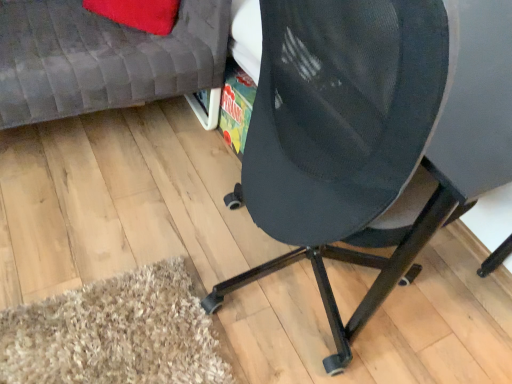
Question: From the image's perspective, is matte gray couch at upper left located above or below black mesh chair at center?

Choices:
 (A) above
 (B) below

Answer: (A)

Question: In terms of height, does matte gray couch at upper left look taller or shorter compared to black mesh chair at center?

Choices:
 (A) tall
 (B) short

Answer: (B)

Question: Is matte gray couch at upper left to the left or to the right of black mesh chair at center in the image?

Choices:
 (A) right
 (B) left

Answer: (B)

Question: From the image's perspective, is black mesh chair at center located above or below matte gray couch at upper left?

Choices:
 (A) below
 (B) above

Answer: (A)

Question: Is black mesh chair at center to the left or to the right of matte gray couch at upper left in the image?

Choices:
 (A) right
 (B) left

Answer: (A)

Question: Which is correct: black mesh chair at center is inside matte gray couch at upper left, or outside of it?

Choices:
 (A) inside
 (B) outside

Answer: (B)

Question: From their relative heights in the image, would you say black mesh chair at center is taller or shorter than matte gray couch at upper left?

Choices:
 (A) tall
 (B) short

Answer: (A)